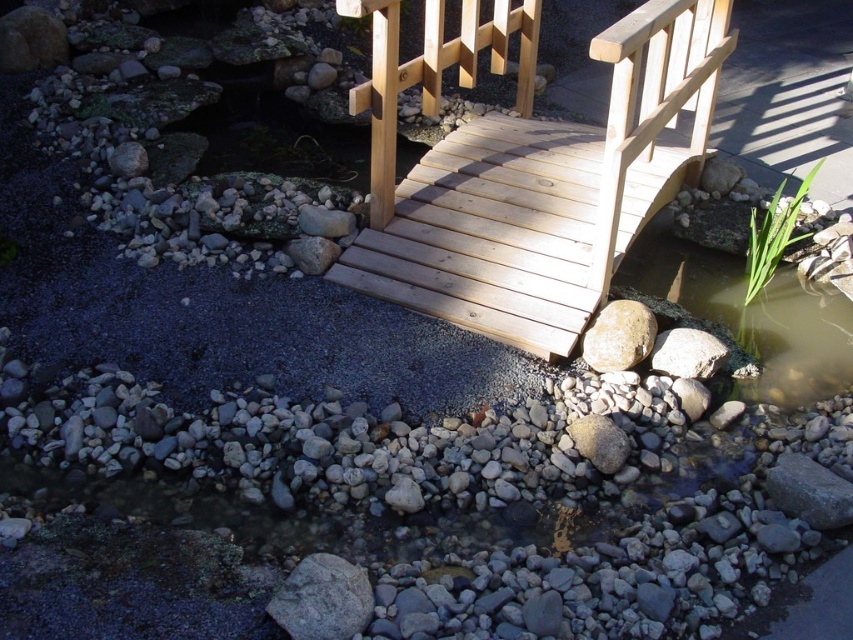
Question: Which point is closer to the camera?

Choices:
 (A) (682, 348)
 (B) (318, 556)

Answer: (B)

Question: From the image, what is the correct spatial relationship of natural wood bridge at center in relation to smooth gray rock at center-right?

Choices:
 (A) above
 (B) below

Answer: (A)

Question: Does green mossy rock at lower right appear on the right side of smooth gray rock at center?

Choices:
 (A) no
 (B) yes

Answer: (B)

Question: Where is natural wood bridge at center located in relation to gray rough rock at lower right in the image?

Choices:
 (A) left
 (B) right

Answer: (A)

Question: Among these points, which one is nearest to the camera?

Choices:
 (A) (614, 445)
 (B) (294, 616)

Answer: (B)

Question: Which object is the closest to the gray rough rock at lower right?

Choices:
 (A) gray rough rock at center
 (B) green mossy rock at lower right
 (C) smooth gray rock at center
 (D) smooth gray rock at center-right

Answer: (D)